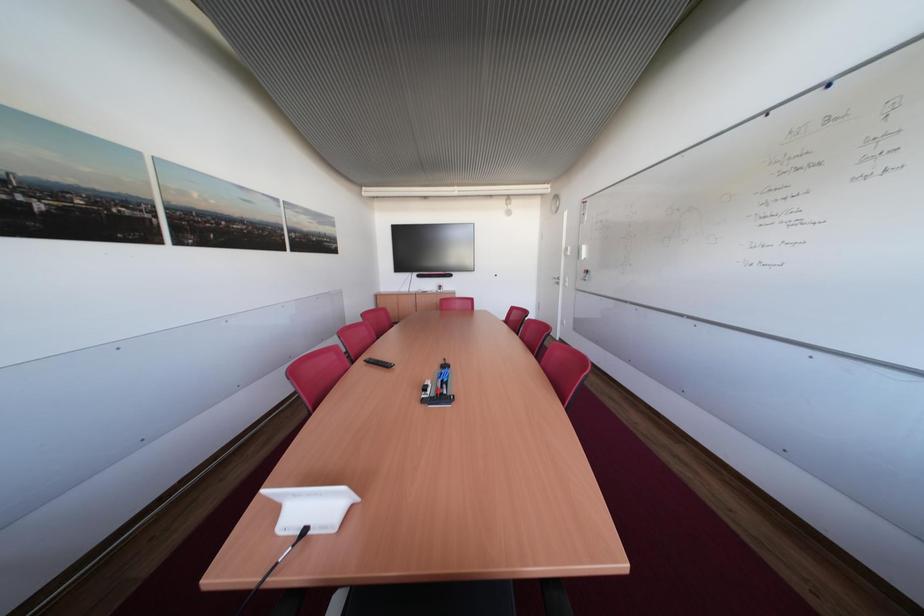
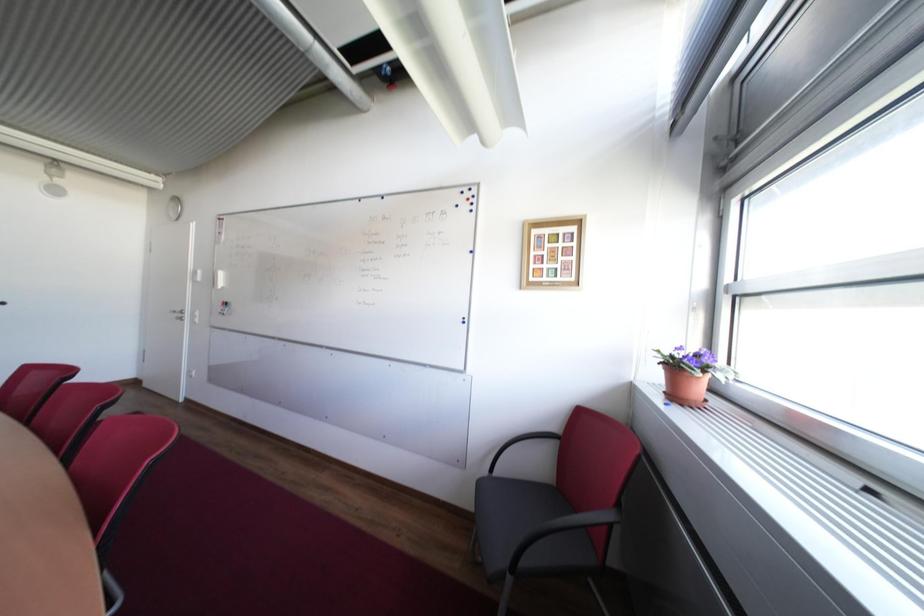
Question: The images are taken continuously from a first-person perspective. In which direction is your viewpoint rotating?

Choices:
 (A) Left
 (B) Right
 (C) Up
 (D) Down

Answer: (B)